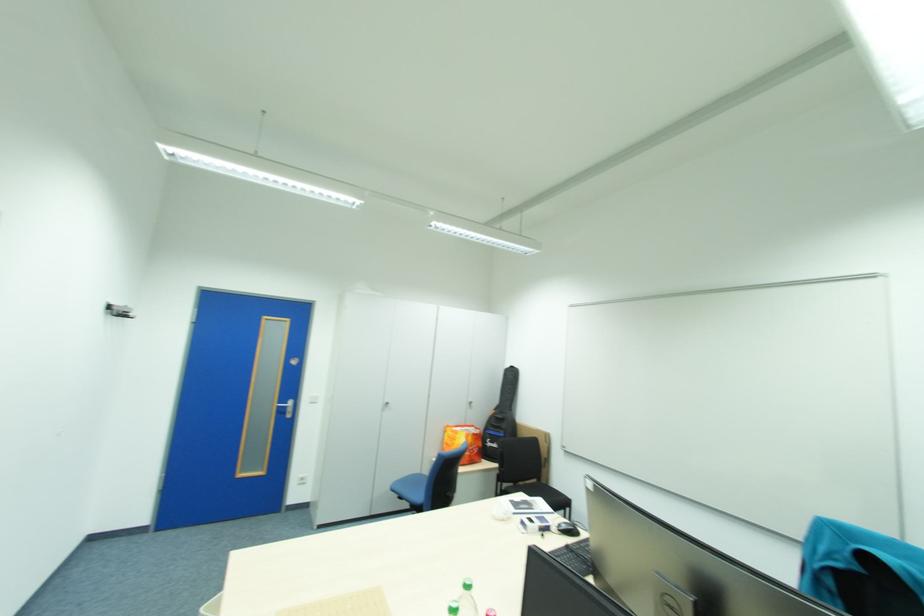
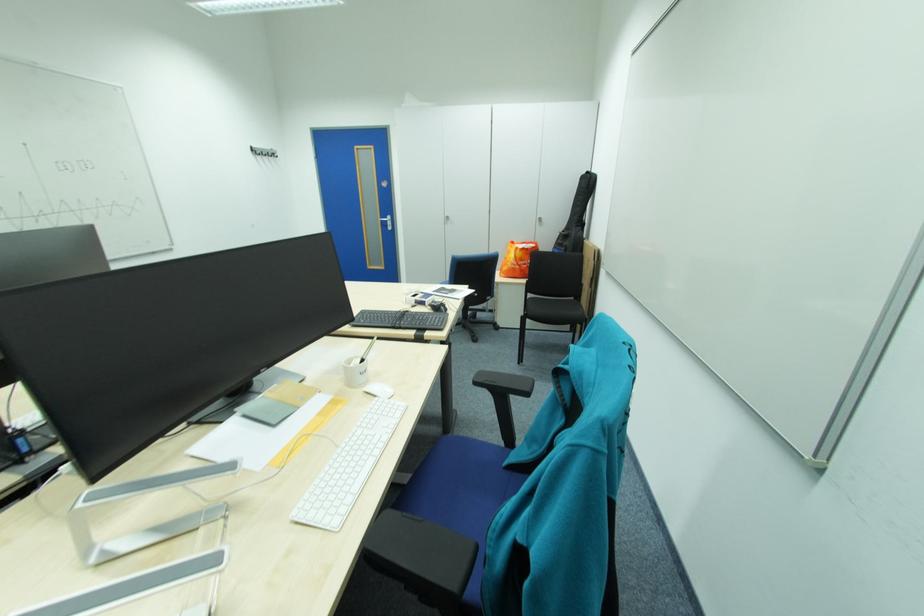
Locate, in the second image, the point that corresponds to [286,407] in the first image.

(390, 221)